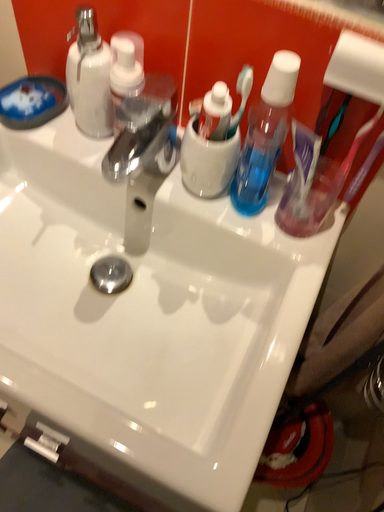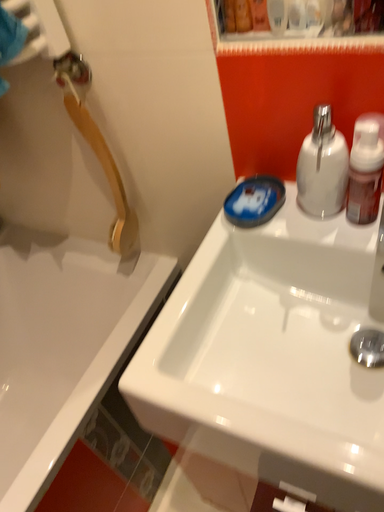
Question: How did the camera likely rotate when shooting the video?

Choices:
 (A) rotated downward
 (B) rotated upward

Answer: (B)